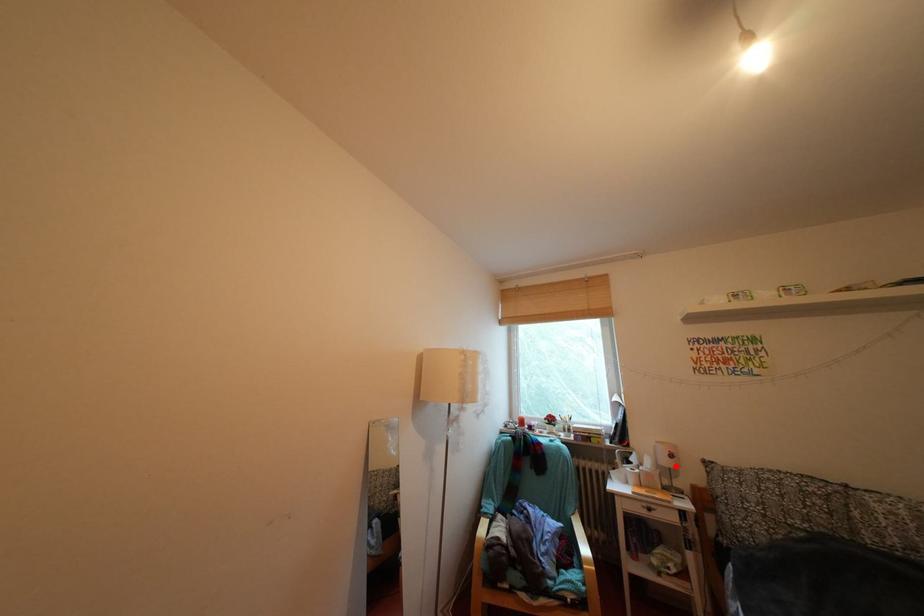
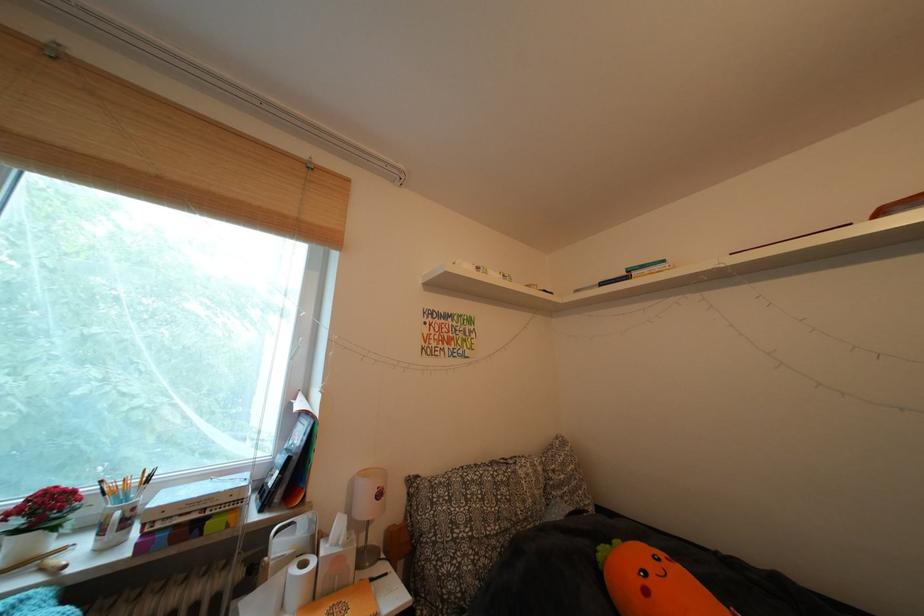
Where in the second image is the point corresponding to the highlighted location from the first image?

(375, 513)